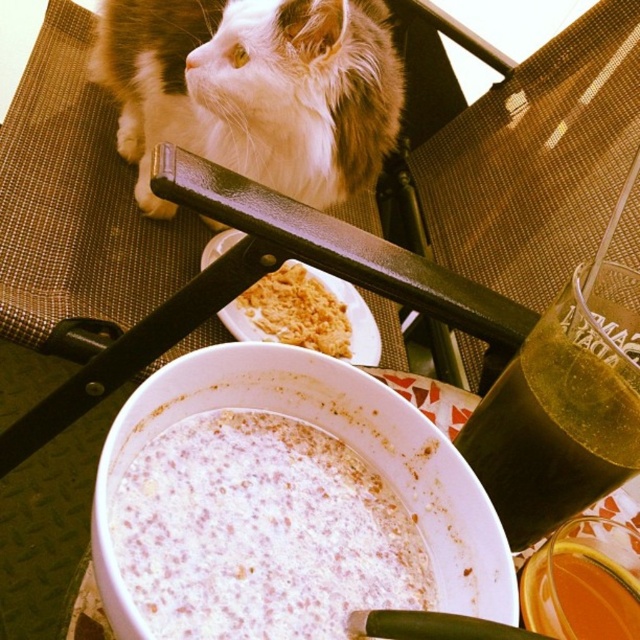
Question: Which of the following is the closest to the observer?

Choices:
 (A) (321, 275)
 (B) (300, 10)
 (C) (285, 317)
 (D) (490, 477)

Answer: (D)

Question: Observing the image, what is the correct spatial positioning of white fluffy cat at upper left in reference to black plastic chair at upper center?

Choices:
 (A) right
 (B) left

Answer: (B)

Question: Does black plastic chair at upper center appear over golden crumbly pie at center?

Choices:
 (A) no
 (B) yes

Answer: (A)

Question: Does white creamy soup at center have a lesser width compared to white fluffy cat at upper left?

Choices:
 (A) yes
 (B) no

Answer: (A)

Question: Which point is farther to the camera?

Choices:
 (A) (145, 566)
 (B) (312, 172)
 (C) (227, 326)

Answer: (B)

Question: Estimate the real-world distances between objects in this image. Which object is farther from the golden crumbly pie at center?

Choices:
 (A) white crumbly at center
 (B) translucent amber liquid at lower right
 (C) green translucent glass at upper right
 (D) white creamy soup at center

Answer: (B)